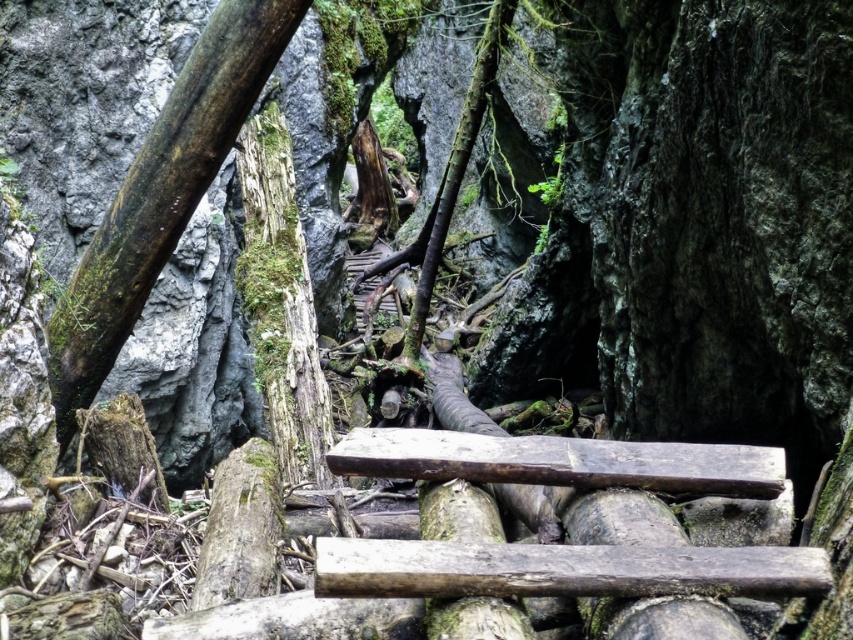
You are a hiker who needs to cross the canyon using the bridge. You notice two wooden components on the bridge. Which component is smaller in size between the dark brown rough log at center and the brown rough wood at center?

The dark brown rough log at center is smaller in size compared to the brown rough wood at center.

You are a hiker standing on the dark brown wood at left. You want to reach the other side of the canyon. The bridge is 5 meters long. Can you safely cross the bridge to the other side?

The dark brown wood at left and viewer are 5.07 meters apart from each other. Since the bridge is 5 meters long, the distance between the dark brown wood at left and the viewer is slightly longer than the bridge length. Therefore, the bridge might not span the entire distance, making it unsafe to cross.